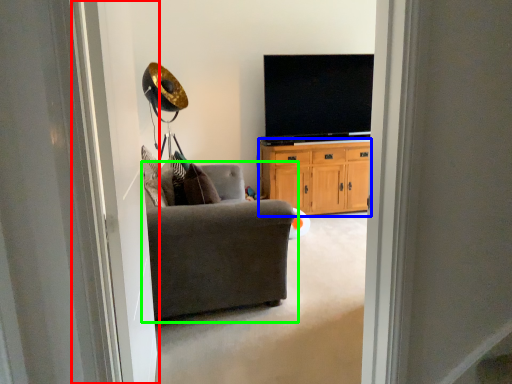
Question: Which object is the farthest from screen door (highlighted by a red box)? Choose among these: cabinetry (highlighted by a blue box) or chair (highlighted by a green box).

Choices:
 (A) cabinetry
 (B) chair

Answer: (A)